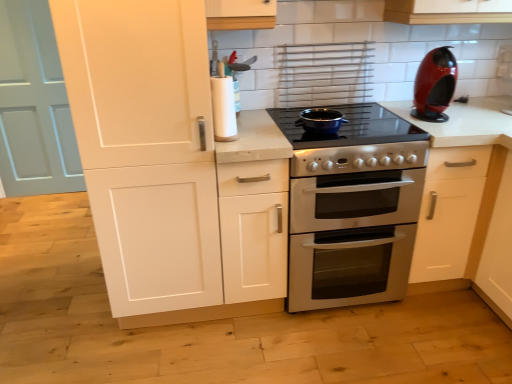
Question: Is light blue wood door at left behind matte black pot at center?

Choices:
 (A) yes
 (B) no

Answer: (A)

Question: From the image's perspective, does light blue wood door at left appear lower than matte black pot at center?

Choices:
 (A) no
 (B) yes

Answer: (A)

Question: Is light blue wood door at left looking in the opposite direction of matte black pot at center?

Choices:
 (A) yes
 (B) no

Answer: (B)

Question: Is light blue wood door at left surrounding matte black pot at center?

Choices:
 (A) yes
 (B) no

Answer: (B)

Question: Does light blue wood door at left come in front of matte black pot at center?

Choices:
 (A) yes
 (B) no

Answer: (B)

Question: Is white matte cabinet at left in front of or behind smooth white countertop at center in the image?

Choices:
 (A) behind
 (B) front

Answer: (B)

Question: Is white matte cabinet at left wider or thinner than smooth white countertop at center?

Choices:
 (A) thin
 (B) wide

Answer: (A)

Question: In terms of height, does white matte cabinet at left look taller or shorter compared to smooth white countertop at center?

Choices:
 (A) tall
 (B) short

Answer: (A)

Question: Is white matte cabinet at left bigger or smaller than smooth white countertop at center?

Choices:
 (A) small
 (B) big

Answer: (B)

Question: From a real-world perspective, is glossy plastic coffee machine at upper right positioned above or below matte black pot at center?

Choices:
 (A) above
 (B) below

Answer: (A)

Question: Visually, is glossy plastic coffee machine at upper right positioned to the left or to the right of matte black pot at center?

Choices:
 (A) left
 (B) right

Answer: (B)

Question: Considering the positions of glossy plastic coffee machine at upper right and matte black pot at center in the image, is glossy plastic coffee machine at upper right wider or thinner than matte black pot at center?

Choices:
 (A) wide
 (B) thin

Answer: (A)

Question: Is glossy plastic coffee machine at upper right situated inside matte black pot at center or outside?

Choices:
 (A) outside
 (B) inside

Answer: (A)

Question: In terms of height, does light blue wood door at left look taller or shorter compared to glossy plastic coffee machine at upper right?

Choices:
 (A) tall
 (B) short

Answer: (A)

Question: Relative to glossy plastic coffee machine at upper right, is light blue wood door at left in front or behind?

Choices:
 (A) front
 (B) behind

Answer: (B)